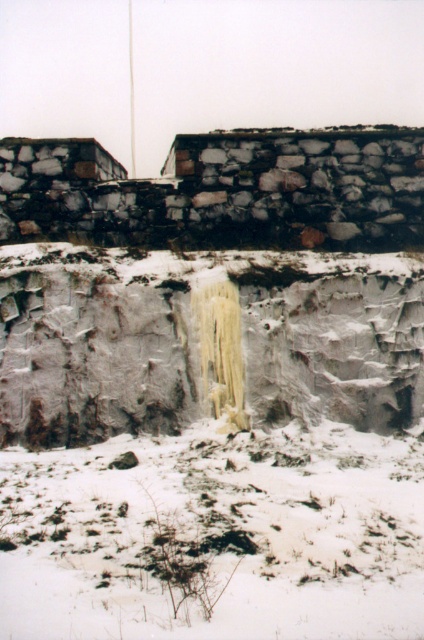
Question: Does white rock cliff at center appear on the right side of metallic flag pole at upper center?

Choices:
 (A) yes
 (B) no

Answer: (A)

Question: Which object appears farthest from the camera in this image?

Choices:
 (A) white rock cliff at center
 (B) metallic flag pole at upper center
 (C) white powdery snow at lower center

Answer: (B)

Question: Does white powdery snow at lower center have a lesser width compared to white rock cliff at center?

Choices:
 (A) yes
 (B) no

Answer: (A)

Question: Observing the image, what is the correct spatial positioning of rough stone wall at upper center in reference to metallic flag pole at upper center?

Choices:
 (A) left
 (B) right

Answer: (B)

Question: Which object is the closest to the white rock cliff at center?

Choices:
 (A) rough stone wall at upper center
 (B) metallic flag pole at upper center
 (C) white powdery snow at lower center

Answer: (A)

Question: Among these points, which one is farthest from the camera?

Choices:
 (A) 309,604
 (B) 134,428
 (C) 117,237

Answer: (C)